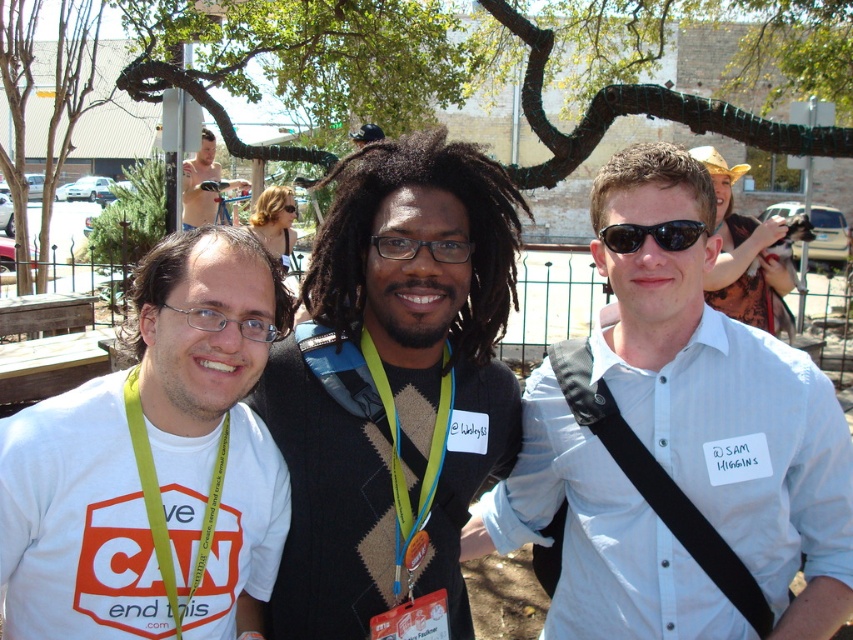
You are a photographer trying to capture a clear shot of the brown sweater at center and the black plastic glasses at center. Which object will appear larger in your photo?

The brown sweater at center will appear larger in the photo because it is closer to the viewer than the black plastic glasses at center.

In the scene described, there is a brown sweater at center located at point (392, 387). Can you determine if the brown sweater at center is positioned to the left or right of the large tree with sprawling branches in the background?

The brown sweater at center is positioned at point (392, 387). Since the large tree with sprawling branches is in the background, it is likely centered behind the individuals, so the brown sweater at center is positioned to the right of the large tree with sprawling branches.

You are standing at the point marked by the coordinates point (511, 428). A friend is standing at your current location. How far apart are you and your friend?

You and your friend are 3.10 meters apart because the point (511, 428) and the viewer are 3.10 meters apart.